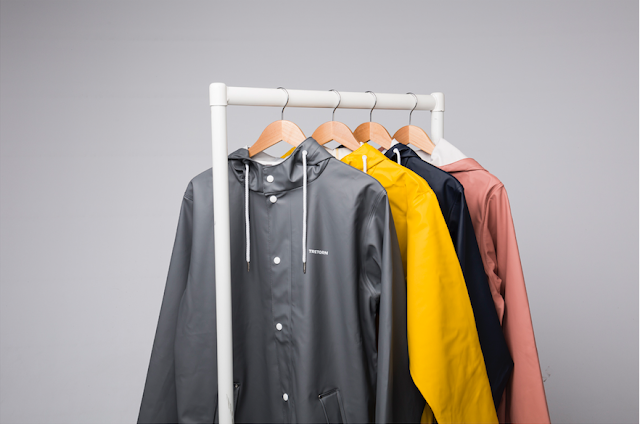
At what (x,y) coordinates should I click in order to perform the action: click on hanger hooks. Please return your answer as a coordinate pair (x, y). This screenshot has width=640, height=424. Looking at the image, I should click on (282, 107), (338, 96), (376, 99), (413, 100).